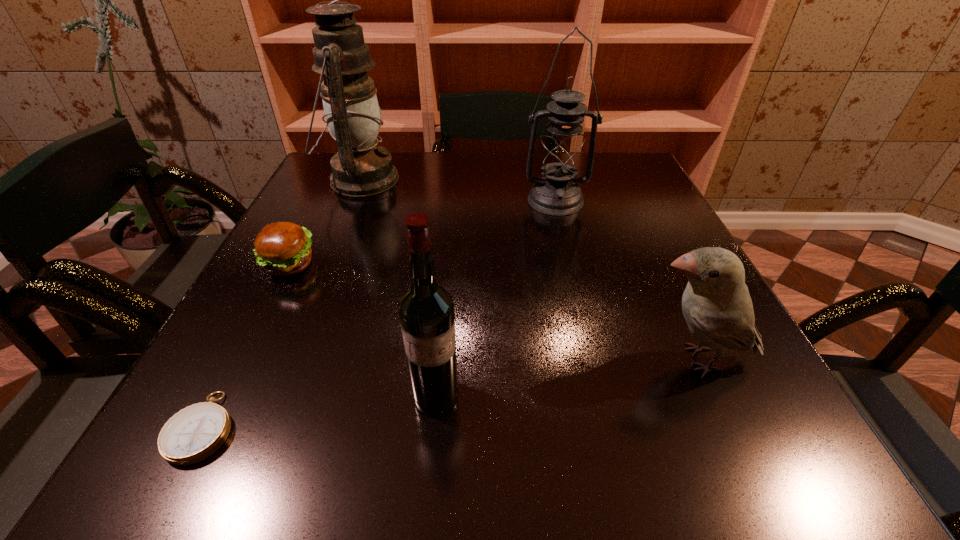
In order to click on the left oil lamp in this screenshot , I will do `click(353, 117)`.

The width and height of the screenshot is (960, 540). In order to click on the right oil lamp in this screenshot , I will do `click(561, 153)`.

The width and height of the screenshot is (960, 540). I want to click on the third object from right to left, so click(x=426, y=310).

What are the coordinates of `wine bottle` in the screenshot? It's located at (426, 310).

The width and height of the screenshot is (960, 540). In order to click on the third shortest object in this screenshot , I will do `click(716, 304)`.

Find the location of a particular element. The image size is (960, 540). the third farthest object is located at coordinates (284, 248).

Where is `the second shortest object`? the second shortest object is located at coordinates (284, 248).

Locate an element on the screen. This screenshot has height=540, width=960. the shortest object is located at coordinates (193, 434).

The width and height of the screenshot is (960, 540). I want to click on free space located on the right of the left oil lamp, so coord(468,180).

Find the location of `free point located on the front of the right oil lamp`. free point located on the front of the right oil lamp is located at coordinates (579, 296).